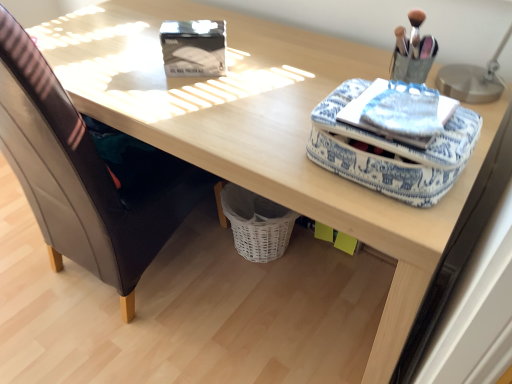
Question: Relative to leather at left, is blue printed fabric notepad at upper right in front or behind?

Choices:
 (A) behind
 (B) front

Answer: (B)

Question: Does point (454, 109) appear closer or farther from the camera than point (51, 125)?

Choices:
 (A) farther
 (B) closer

Answer: (B)

Question: Based on their relative distances, which object is nearer to the blue fabric case at upper right?

Choices:
 (A) blue printed fabric notepad at upper right
 (B) matte black storage box at upper center
 (C) leather at left
 (D) metallic silver table lamp at upper right

Answer: (A)

Question: Which of these objects is positioned farthest from the matte black storage box at upper center?

Choices:
 (A) blue printed fabric notepad at upper right
 (B) blue fabric case at upper right
 (C) metallic silver table lamp at upper right
 (D) leather at left

Answer: (C)